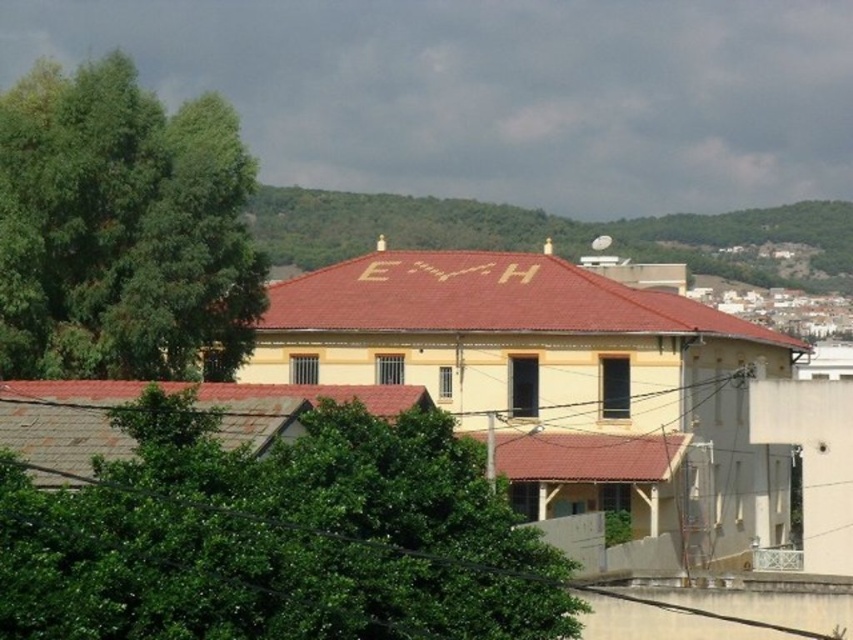
Does green leafy tree at lower left have a lesser height compared to green leafy hillside at upper center?

Correct, green leafy tree at lower left is not as tall as green leafy hillside at upper center.

Does point (157, 620) lie in front of point (680, 260)?

Yes, point (157, 620) is closer to viewer.

Identify the location of green leafy tree at lower left. This screenshot has height=640, width=853. 277,538.

Does point (210, 176) come closer to viewer compared to point (460, 234)?

That is True.

Does green leafy tree at left have a lesser height compared to green leafy hillside at upper center?

Correct, green leafy tree at left is not as tall as green leafy hillside at upper center.

Is point (225, 348) positioned behind point (776, 273)?

No.

Identify the location of green leafy tree at left. (123, 230).

Can you confirm if green leafy tree at lower left is positioned above green leafy tree at left?

Incorrect, green leafy tree at lower left is not positioned above green leafy tree at left.

Between green leafy tree at lower left and green leafy tree at left, which one is positioned lower?

green leafy tree at lower left

Is point (479, 483) less distant than point (114, 100)?

Yes, point (479, 483) is in front of point (114, 100).

The image size is (853, 640). Identify the location of green leafy tree at lower left. (277, 538).